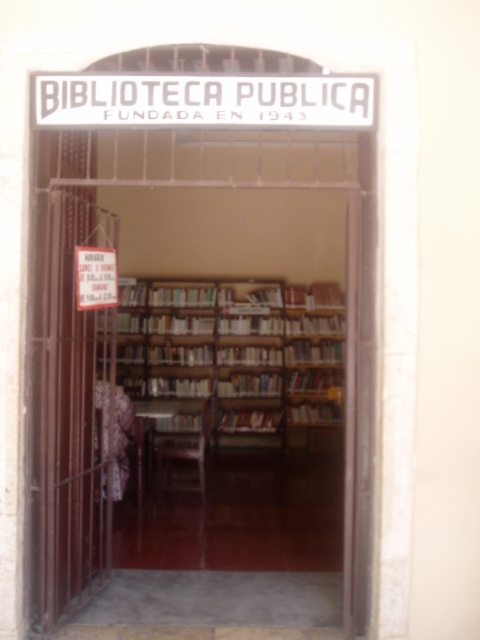
From the picture: Which of these two, wooden bookcase at center or hardcover book at center, stands taller?

wooden bookcase at center

Is wooden bookcase at center positioned before hardcover book at center?

Yes, wooden bookcase at center is in front of hardcover book at center.

Describe the element at coordinates (235, 348) in the screenshot. I see `wooden bookcase at center` at that location.

The height and width of the screenshot is (640, 480). I want to click on wooden bookcase at center, so click(x=235, y=348).

Between point (158, 378) and point (97, 282), which one is positioned in front?

Point (97, 282) is more forward.

Which is below, wooden bookcase at center or white paper sign at center?

wooden bookcase at center is below.

Consider the image. Who is more distant from viewer, [222,396] or [92,282]?

The point [222,396] is more distant.

Find the location of a particular element. The height and width of the screenshot is (640, 480). wooden bookcase at center is located at coordinates (235, 348).

I want to click on white metallic sign at upper center, so click(202, 100).

Does white metallic sign at upper center appear on the left side of hardcover book at center?

Indeed, white metallic sign at upper center is positioned on the left side of hardcover book at center.

You are a GUI agent. You are given a task and a screenshot of the screen. Output one action in this format:
    pyautogui.click(x=<x>, y=<y>)
    Task: Click on the white metallic sign at upper center
    
    Given the screenshot: What is the action you would take?
    pyautogui.click(x=202, y=100)

The height and width of the screenshot is (640, 480). I want to click on white metallic sign at upper center, so click(x=202, y=100).